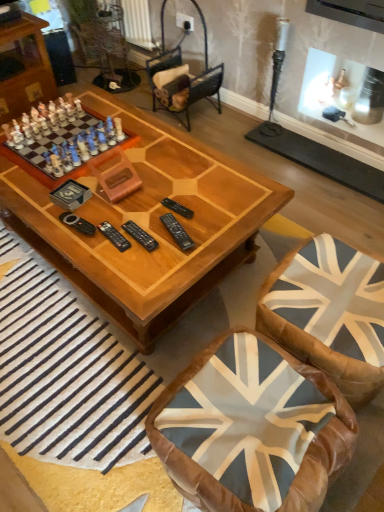
Find the location of a particular element. Image resolution: width=384 pixels, height=512 pixels. vacant region to the right of porcelain chess set at left is located at coordinates (157, 158).